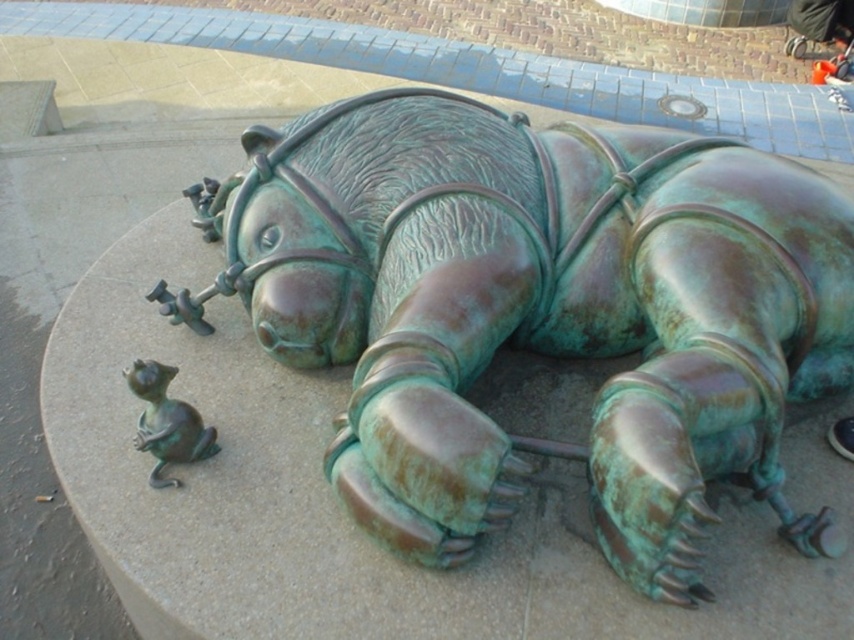
Does green patina horse at center have a greater width compared to green patina mouse at lower left?

Yes, green patina horse at center is wider than green patina mouse at lower left.

Based on the photo, between green patina horse at center and green patina mouse at lower left, which one appears on the left side from the viewer's perspective?

green patina mouse at lower left

Image resolution: width=854 pixels, height=640 pixels. Describe the element at coordinates (537, 310) in the screenshot. I see `green patina horse at center` at that location.

You are a GUI agent. You are given a task and a screenshot of the screen. Output one action in this format:
    pyautogui.click(x=<x>, y=<y>)
    Task: Click on the green patina horse at center
    The width and height of the screenshot is (854, 640).
    Given the screenshot: What is the action you would take?
    pyautogui.click(x=537, y=310)